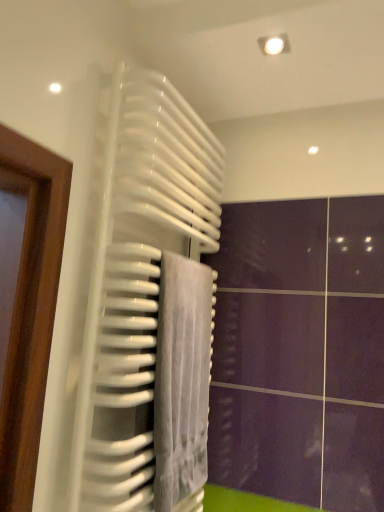
Question: From the image's perspective, relative to white glossy radiator at center, is gray velvety towel at center above or below?

Choices:
 (A) above
 (B) below

Answer: (B)

Question: In terms of width, does gray velvety towel at center look wider or thinner when compared to white glossy radiator at center?

Choices:
 (A) wide
 (B) thin

Answer: (B)

Question: In the image, is gray velvety towel at center positioned in front of or behind white glossy radiator at center?

Choices:
 (A) behind
 (B) front

Answer: (A)

Question: In the image, is white glossy radiator at center on the left side or the right side of gray velvety towel at center?

Choices:
 (A) right
 (B) left

Answer: (B)

Question: Is white glossy radiator at center inside or outside of gray velvety towel at center?

Choices:
 (A) outside
 (B) inside

Answer: (A)

Question: Looking at their shapes, would you say white glossy radiator at center is wider or thinner than gray velvety towel at center?

Choices:
 (A) thin
 (B) wide

Answer: (B)

Question: Is white glossy radiator at center bigger or smaller than gray velvety towel at center?

Choices:
 (A) big
 (B) small

Answer: (A)